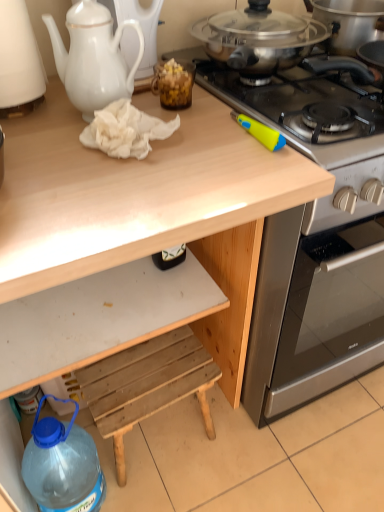
Identify the location of vacant area situated to the left side of translucent brown jar at upper center. (68, 115).